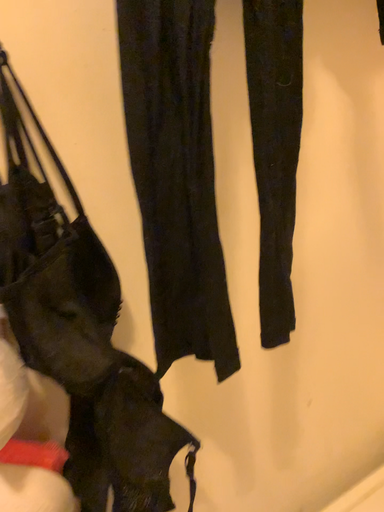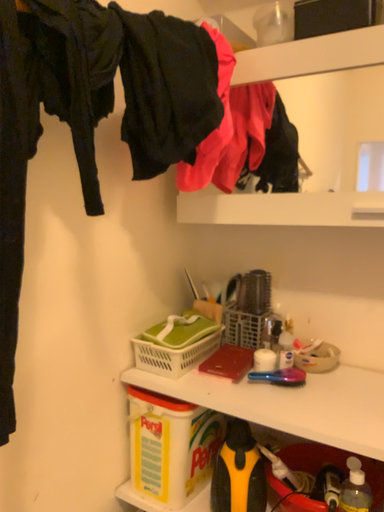
Question: How did the camera likely rotate when shooting the video?

Choices:
 (A) rotated right
 (B) rotated left

Answer: (A)